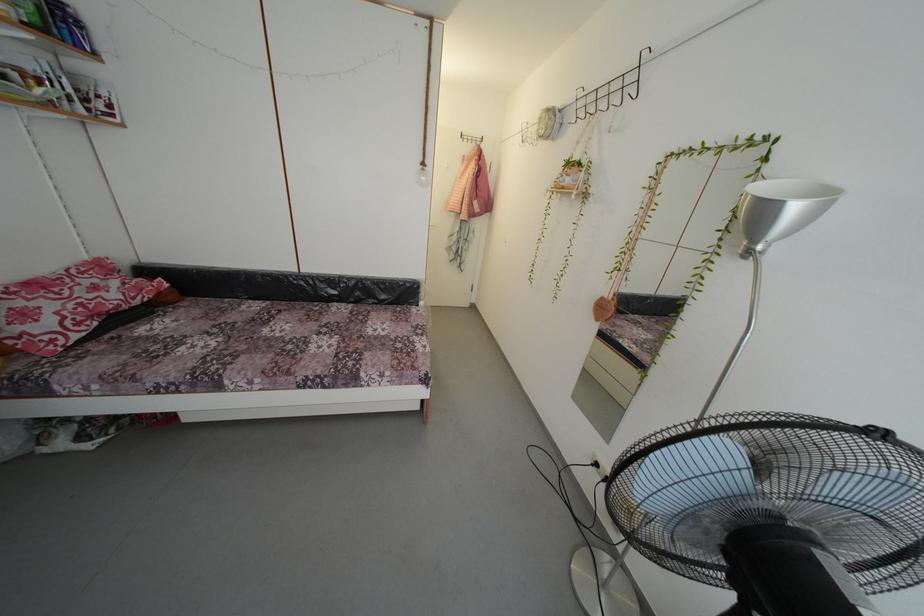
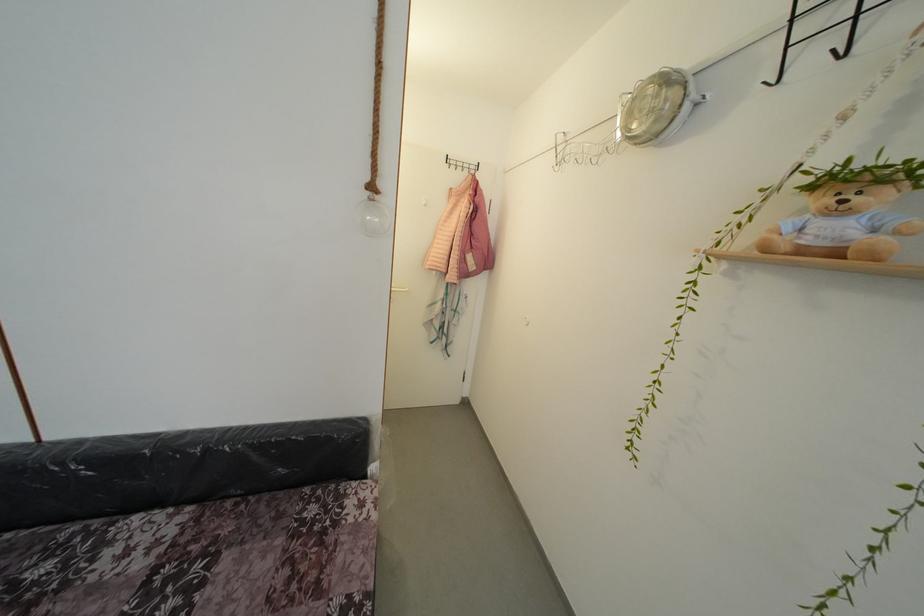
Locate, in the second image, the point that corresponds to (x=362, y=286) in the first image.

(213, 456)